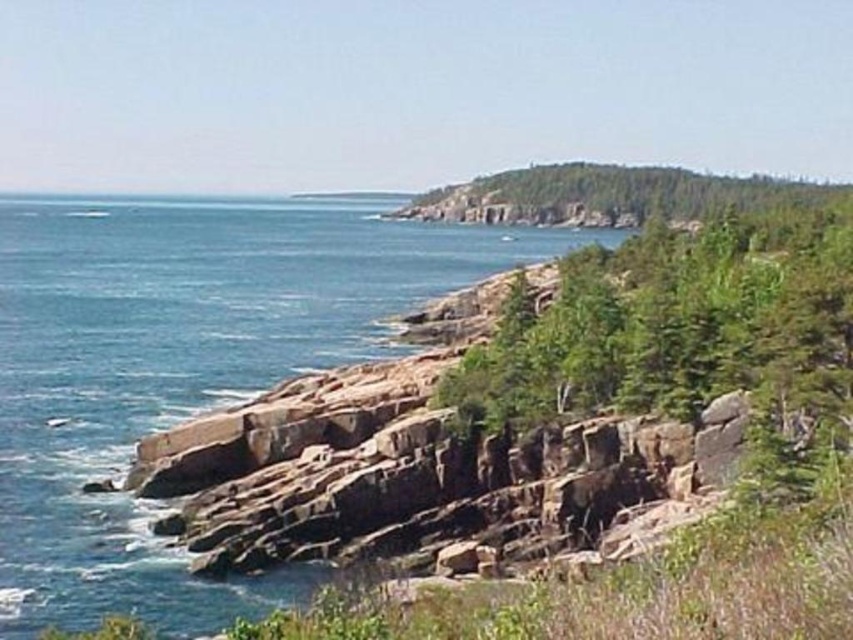
Is blue water at center to the right of green leafy hillside at upper center from the viewer's perspective?

In fact, blue water at center is to the left of green leafy hillside at upper center.

Can you confirm if blue water at center is taller than green leafy hillside at upper center?

No.

Is point (167, 417) behind point (500, 173)?

No, it is in front of (500, 173).

This screenshot has width=853, height=640. I want to click on blue water at center, so click(x=183, y=369).